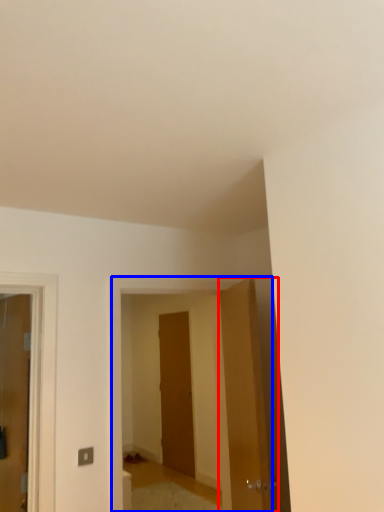
Question: Which object appears closest to the camera in this image, door (highlighted by a red box) or elevator (highlighted by a blue box)?

Choices:
 (A) door
 (B) elevator

Answer: (A)